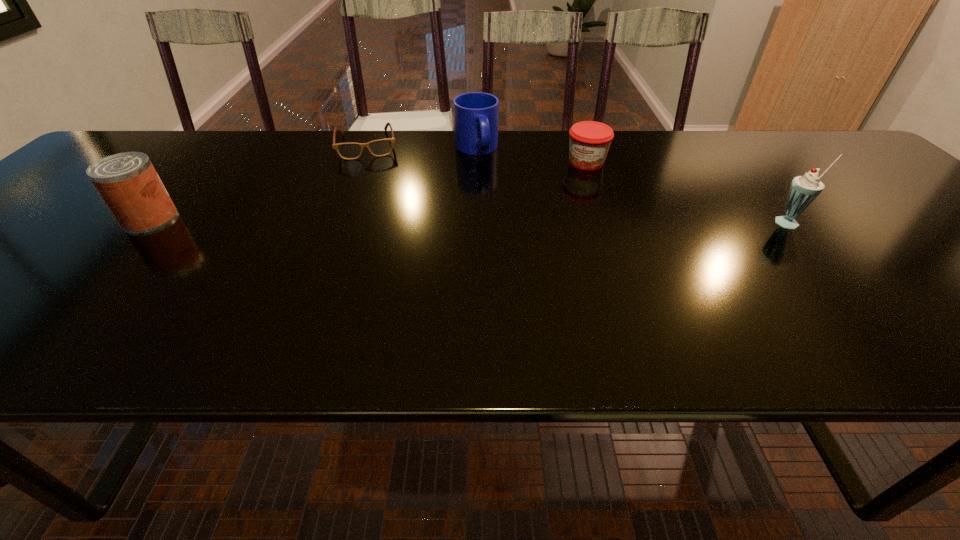
You are a GUI agent. You are given a task and a screenshot of the screen. Output one action in this format:
    pyautogui.click(x=<x>, y=<y>)
    Task: Click on the jam that is at the far edge
    Image resolution: width=960 pixels, height=540 pixels.
    Given the screenshot: What is the action you would take?
    pyautogui.click(x=589, y=140)

What are the coordinates of `free space at the far edge of the desktop` in the screenshot? It's located at (631, 154).

Locate an element on the screen. vacant position at the near edge of the desktop is located at coordinates click(797, 312).

The width and height of the screenshot is (960, 540). I want to click on vacant space at the right edge, so click(875, 201).

This screenshot has width=960, height=540. In order to click on blank area at the far left corner in this screenshot , I will do `click(124, 140)`.

Image resolution: width=960 pixels, height=540 pixels. What are the coordinates of `free area in between the third object from left to right and the leftmost object` in the screenshot? It's located at (313, 184).

Image resolution: width=960 pixels, height=540 pixels. What are the coordinates of `free spot between the second object from right to left and the mug` in the screenshot? It's located at (531, 156).

Where is `free spot between the milkshake and the mug`? Image resolution: width=960 pixels, height=540 pixels. free spot between the milkshake and the mug is located at coordinates (634, 186).

Where is `vacant space that is in between the second object from left to right and the rightmost object`? vacant space that is in between the second object from left to right and the rightmost object is located at coordinates (580, 184).

Identify the location of vacant space in between the third object from right to left and the shortest object. (422, 147).